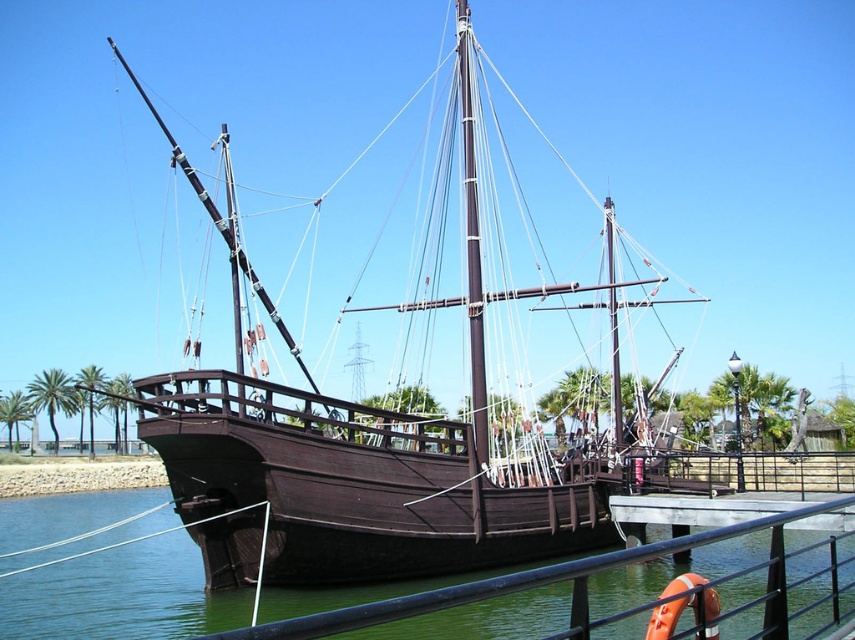
Question: Is dark brown wooden pirate ship at center to the left of black metal/rail at lower center from the viewer's perspective?

Choices:
 (A) yes
 (B) no

Answer: (A)

Question: Which point is closer to the camera?

Choices:
 (A) (352, 516)
 (B) (781, 524)

Answer: (B)

Question: Does dark brown wooden pirate ship at center have a lesser width compared to black metal/rail at lower center?

Choices:
 (A) yes
 (B) no

Answer: (B)

Question: Which of the following is the closest to the observer?

Choices:
 (A) dark brown wooden pirate ship at center
 (B) black metal/rail at lower center

Answer: (B)

Question: Does dark brown wooden pirate ship at center appear under black metal/rail at lower center?

Choices:
 (A) yes
 (B) no

Answer: (B)